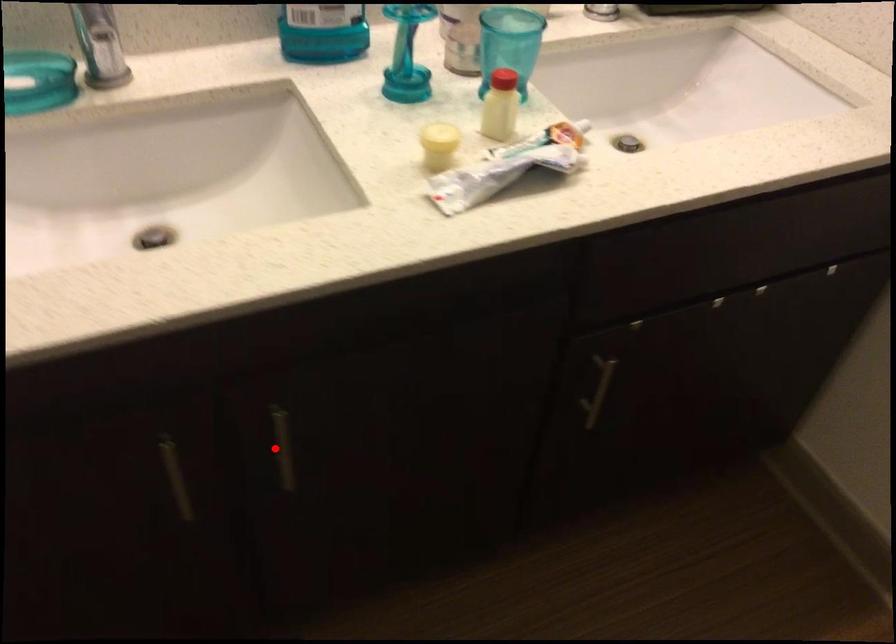
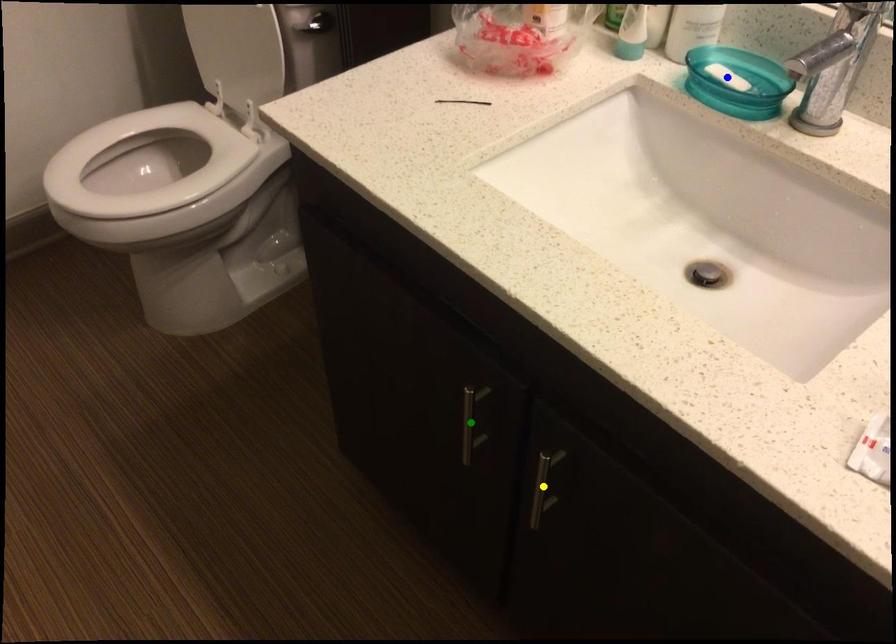
Question: I am providing you with two images of the same scene from different viewpoints. A red point is marked on the first image. You are given multiple points on the second image. In image 2, which mark is for the same physical point as the one in image 1?

Choices:
 (A) yellow point
 (B) blue point
 (C) green point

Answer: (A)